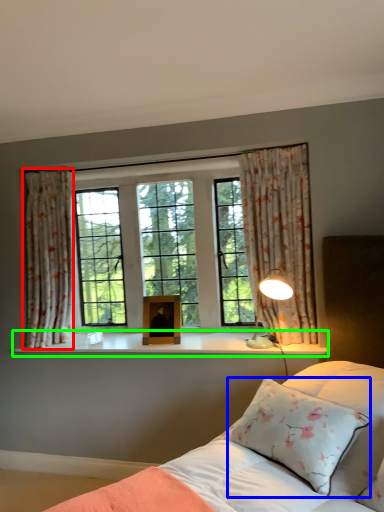
Question: Which is nearer to the curtain (highlighted by a red box)? pillow (highlighted by a blue box) or window sill (highlighted by a green box).

Choices:
 (A) pillow
 (B) window sill

Answer: (B)